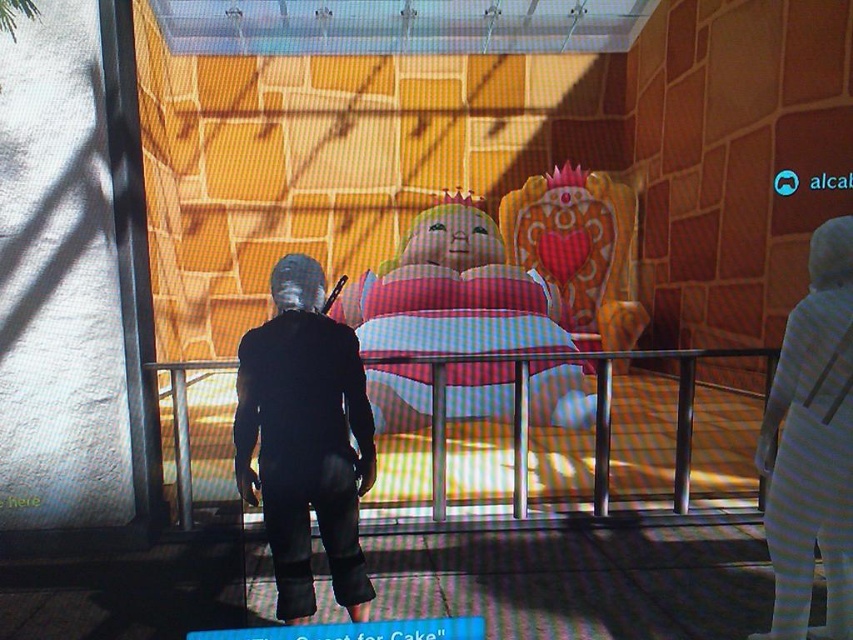
Which is in front, point (485, 276) or point (785, 570)?

Point (785, 570) is more forward.

Is point (399, 378) in front of point (804, 440)?

That is False.

Does point (413, 332) lie in front of point (844, 460)?

No, (413, 332) is behind (844, 460).

Find the location of a particular element. This screenshot has height=640, width=853. plush pink doll at center is located at coordinates (451, 292).

Who is higher up, black matte suit at center or white striped fabric doll at right?

white striped fabric doll at right is higher up.

Identify the location of black matte suit at center. The height and width of the screenshot is (640, 853). (305, 440).

Locate an element on the screen. Image resolution: width=853 pixels, height=640 pixels. black matte suit at center is located at coordinates (305, 440).

Locate an element on the screen. This screenshot has height=640, width=853. black matte suit at center is located at coordinates (305, 440).

Which is above, plush pink doll at center or black matte suit at center?

plush pink doll at center

Measure the distance between plush pink doll at center and camera.

The distance of plush pink doll at center from camera is 6.88 meters.

At what (x,y) coordinates should I click in order to perform the action: click on plush pink doll at center. Please return your answer as a coordinate pair (x, y). Image resolution: width=853 pixels, height=640 pixels. Looking at the image, I should click on (451, 292).